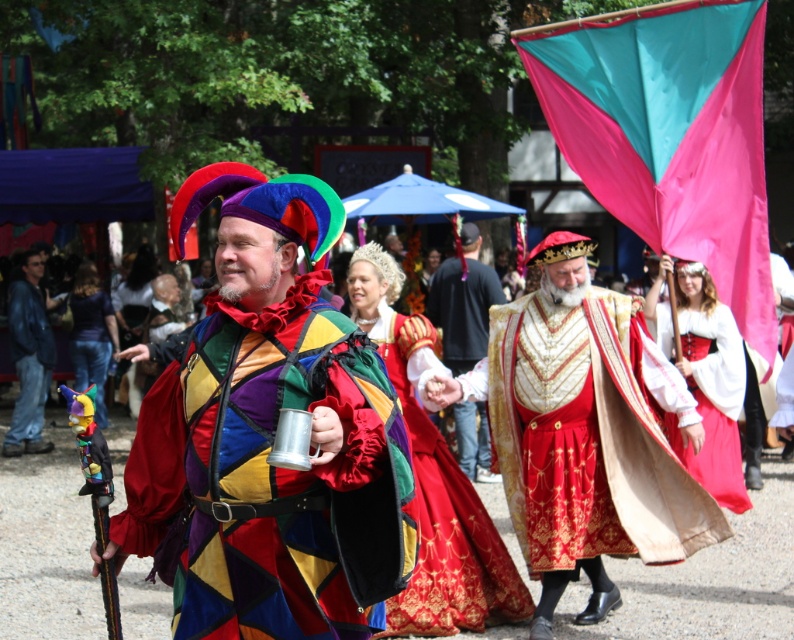
Question: In this image, where is matte metallic mug at center located relative to metallic silver tankard at center?

Choices:
 (A) below
 (B) above

Answer: (B)

Question: Considering the real-world distances, which object is farthest from the metallic silver tankard at center?

Choices:
 (A) metallic silver cup at center
 (B) gold embroidered tunic at center

Answer: (A)

Question: Which point is closer to the camera taking this photo?

Choices:
 (A) (349, 570)
 (B) (17, 292)
 (C) (715, 342)

Answer: (A)

Question: Can you confirm if gold embroidered tunic at center is positioned below metallic silver cup at center?

Choices:
 (A) yes
 (B) no

Answer: (A)

Question: Does matte metallic mug at center have a larger size compared to metallic silver tankard at center?

Choices:
 (A) no
 (B) yes

Answer: (A)

Question: Which of the following is the farthest from the observer?

Choices:
 (A) white satin dress at center
 (B) gold embroidered tunic at center
 (C) brushed metal mug at left

Answer: (C)